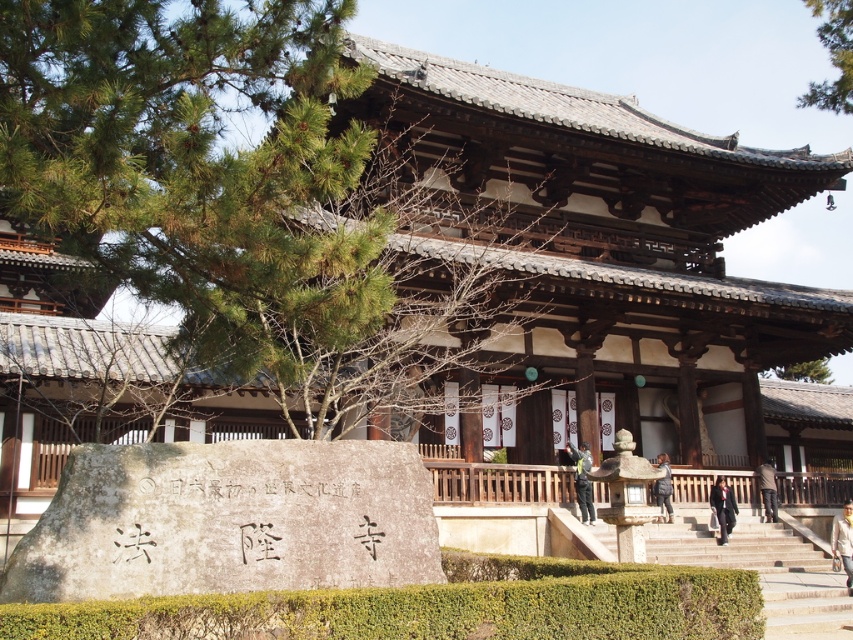
You are standing in front of the temple and notice the green pine tree at upper left. Based on its coordinates, is the tree positioned closer to the left or right side of the image?

The green pine tree at upper left is located at point 0.233 on the horizontal axis, which indicates it is closer to the left side of the image.

You are an architect designing a garden layout and want to place a statue between the green leafy tree at upper right and the green leafy tree at upper center. Based on their widths, which tree should the statue be closer to?

The statue should be closer to the green leafy tree at upper center because the green leafy tree at upper right is wider. Placing it closer to the narrower tree balances the spacing between them.

You are standing in front of the temple and notice two green leafy trees in the background. Which tree, the green leafy tree at upper right or the green leafy tree at upper center, is positioned higher up in the image?

The green leafy tree at upper right is positioned higher up in the image than the green leafy tree at upper center.